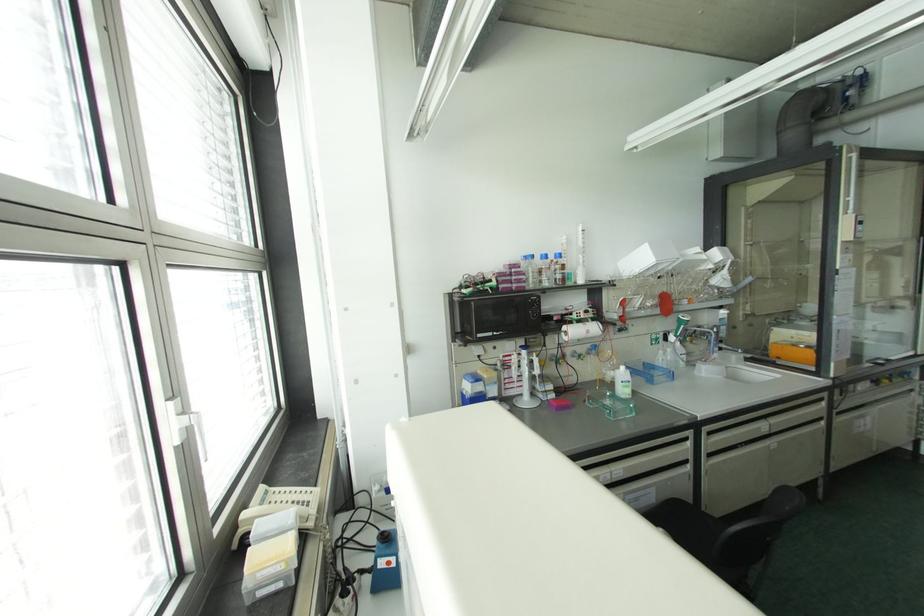
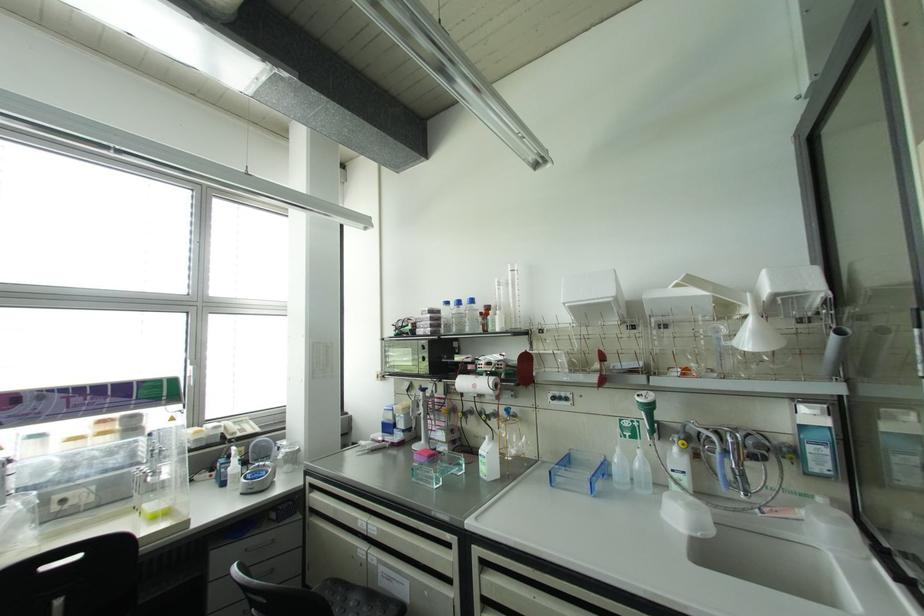
In the second image, find the point that corresponds to the point at 588,331 in the first image.

(473, 386)